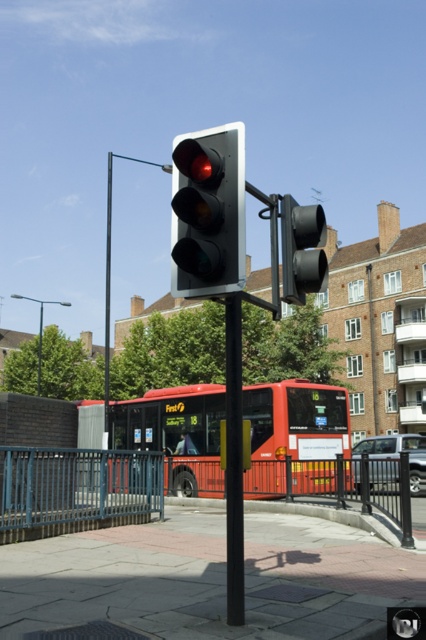
You are a city planner analyzing the street layout. The black matte pole at center and the black matte traffic light at center are both in your view. Which object takes up more visual space in the image?

The black matte traffic light at center takes up more visual space than the black matte pole at center because the pole occupies less space according to the description.

From the picture: You are a pedestrian standing at the metallic blue bus stop at lower left. You want to cross the street to reach a coffee shop on the opposite side. The black matte pole at center is in your path. Can you walk around the pole to get to the coffee shop?

The black matte pole at center is behind the metallic blue bus stop at lower left, so you can walk around the pole to reach the coffee shop.

You are a passenger waiting at the metallic blue bus stop at lower left and want to board the red matte bus at center. Is the bus within your reach from the bus stop?

The red matte bus at center is located below the metallic blue bus stop at lower left, so the bus is directly underneath the bus stop, making it easily accessible for boarding.